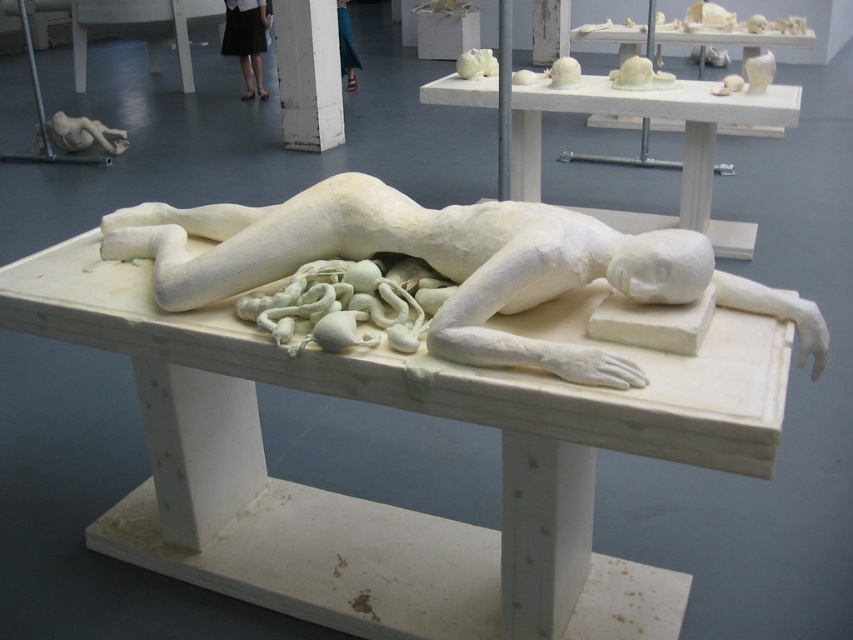
Does white marble table at center have a smaller size compared to white matte hand at center?

Actually, white marble table at center might be larger than white matte hand at center.

Can you confirm if white marble table at center is wider than white matte hand at center?

Yes, white marble table at center is wider than white matte hand at center.

Is point (132, 540) positioned after point (572, 372)?

Yes, point (132, 540) is behind point (572, 372).

Identify the location of white marble table at center. (393, 506).

Between point (321, 605) and point (248, 1), which one is positioned in front?

Positioned in front is point (321, 605).

Measure the distance from white marble table at center to black skirt at upper center.

They are 6.80 meters apart.

Where is `white marble table at center`? white marble table at center is located at coordinates tap(393, 506).

Is white matte sculpture at center shorter than white matte table at upper center?

Correct, white matte sculpture at center is not as tall as white matte table at upper center.

Does point (299, 198) lie behind point (758, 108)?

That is False.

Which is in front, point (450, 352) or point (527, 189)?

Positioned in front is point (450, 352).

Identify the location of white matte sculpture at center. This screenshot has width=853, height=640. (440, 259).